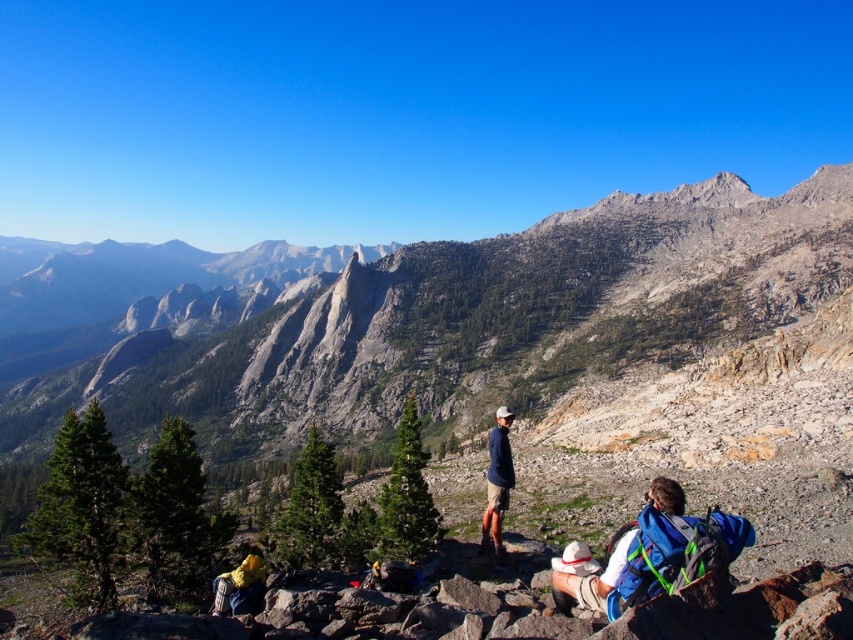
Question: Which of the following is the closest to the observer?

Choices:
 (A) (257, 611)
 (B) (701, 285)

Answer: (A)

Question: Which point is closer to the camera taking this photo?

Choices:
 (A) (254, 604)
 (B) (511, 326)

Answer: (A)

Question: Does gray rocky mountain at center appear under yellow fabric backpack at lower left?

Choices:
 (A) no
 (B) yes

Answer: (A)

Question: In this image, where is gray rocky mountain at center located relative to yellow fabric backpack at lower left?

Choices:
 (A) left
 (B) right

Answer: (A)

Question: Which point is closer to the camera?

Choices:
 (A) (260, 563)
 (B) (712, 268)

Answer: (A)

Question: From the image, what is the correct spatial relationship of gray rocky mountain at center in relation to yellow fabric backpack at lower left?

Choices:
 (A) left
 (B) right

Answer: (A)